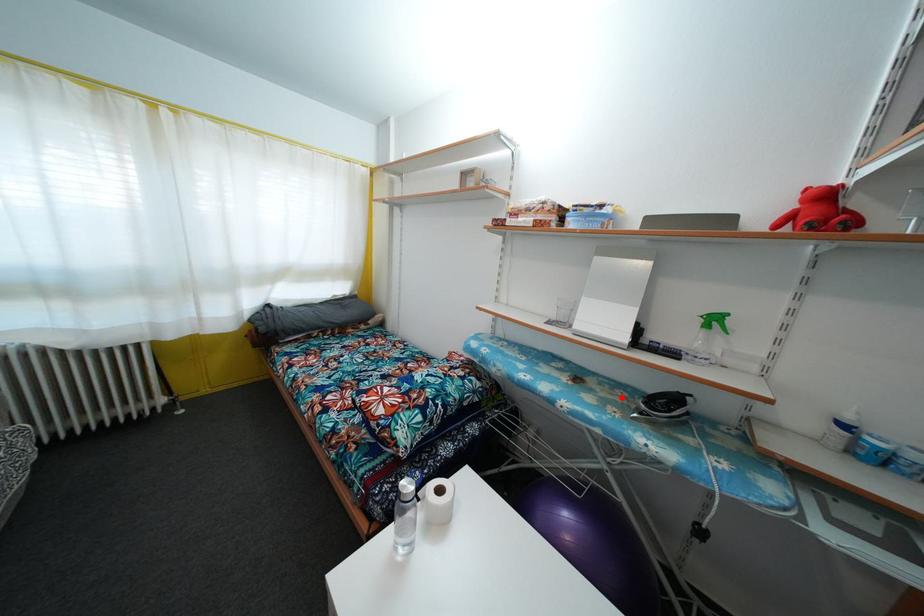
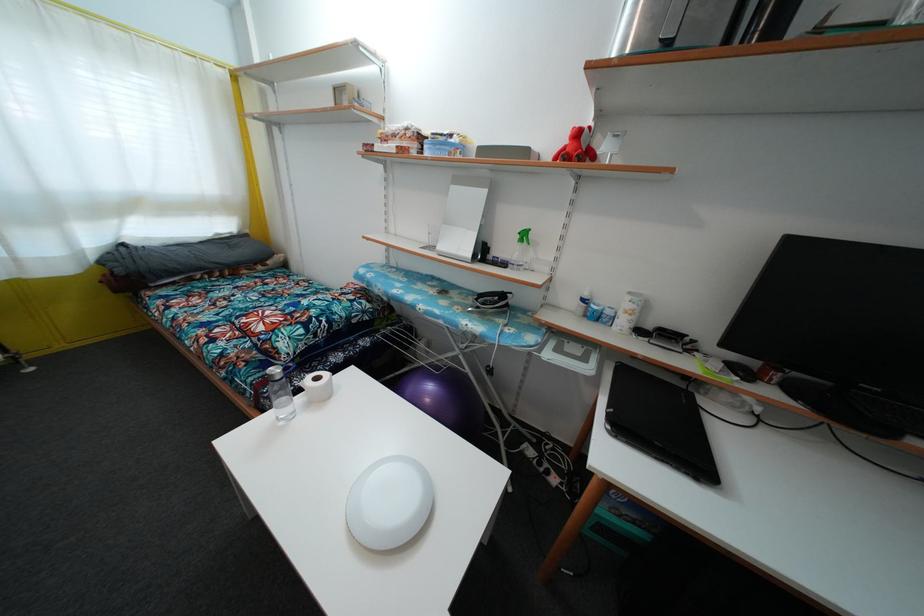
In the second image, find the point that corresponds to the highlighted location in the first image.

(475, 304)